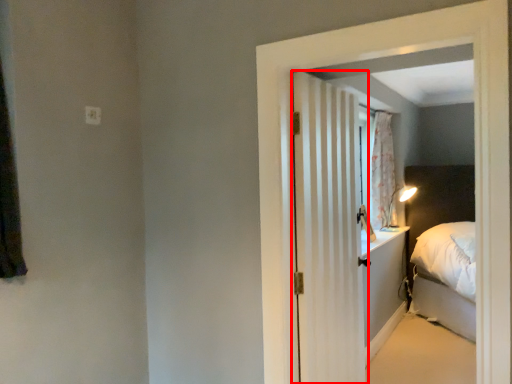
Question: From the image's perspective, what is the correct spatial positioning of door (annotated by the red box) in reference to electric outlet?

Choices:
 (A) below
 (B) above

Answer: (A)